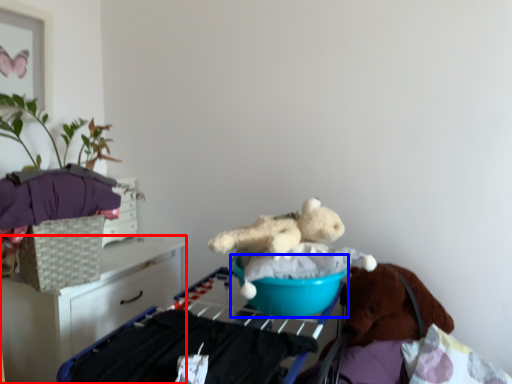
Question: Which point is closer to the camera, furniture (highlighted by a red box) or basin (highlighted by a blue box)?

Choices:
 (A) furniture
 (B) basin

Answer: (B)